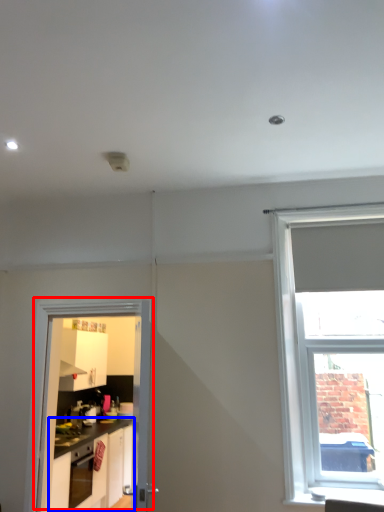
Question: Which object is further to the camera taking this photo, door (highlighted by a red box) or cabinetry (highlighted by a blue box)?

Choices:
 (A) door
 (B) cabinetry

Answer: (B)